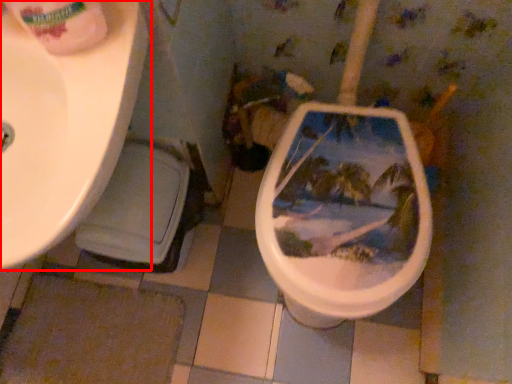
Question: Considering the relative positions of sink (annotated by the red box) and toilet paper in the image provided, where is sink (annotated by the red box) located with respect to the staircase?

Choices:
 (A) left
 (B) right

Answer: (A)